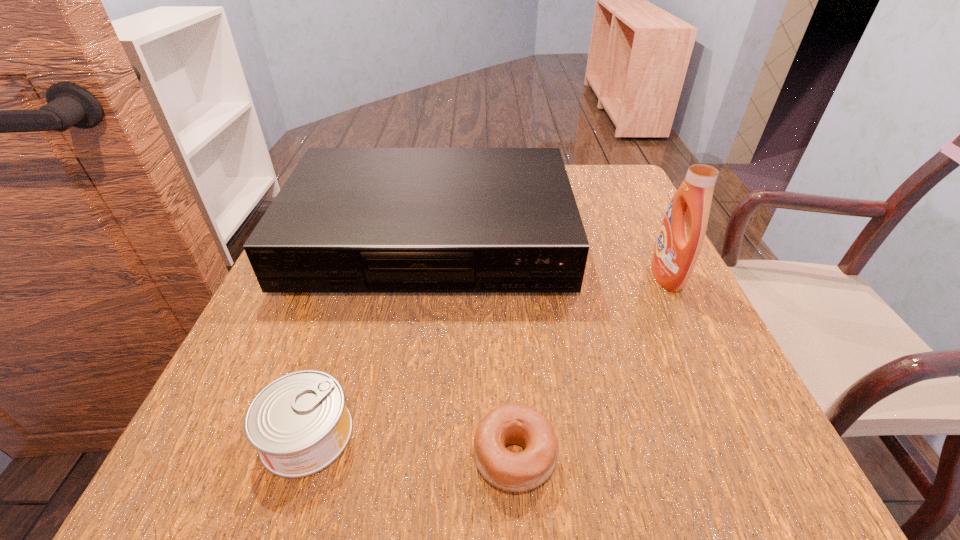
The image size is (960, 540). What are the coordinates of `vacant space located 0.160m on the left of the bagel` in the screenshot? It's located at (352, 456).

Locate an element on the screen. object present at the far edge is located at coordinates (348, 220).

What are the coordinates of `can at the near edge` in the screenshot? It's located at (299, 423).

At what (x,y) coordinates should I click in order to perform the action: click on bagel that is at the near edge. Please return your answer as a coordinate pair (x, y). The image size is (960, 540). Looking at the image, I should click on (514, 423).

The height and width of the screenshot is (540, 960). Identify the location of CD player that is at the left edge. (348, 220).

Locate an element on the screen. can located at the left edge is located at coordinates (299, 423).

The height and width of the screenshot is (540, 960). I want to click on object that is positioned at the right edge, so click(x=681, y=236).

Where is `object that is positioned at the far left corner`? This screenshot has height=540, width=960. object that is positioned at the far left corner is located at coordinates (348, 220).

Where is `object present at the near left corner`? Image resolution: width=960 pixels, height=540 pixels. object present at the near left corner is located at coordinates (299, 423).

Where is `vacant space at the near edge of the desktop`? This screenshot has width=960, height=540. vacant space at the near edge of the desktop is located at coordinates (544, 495).